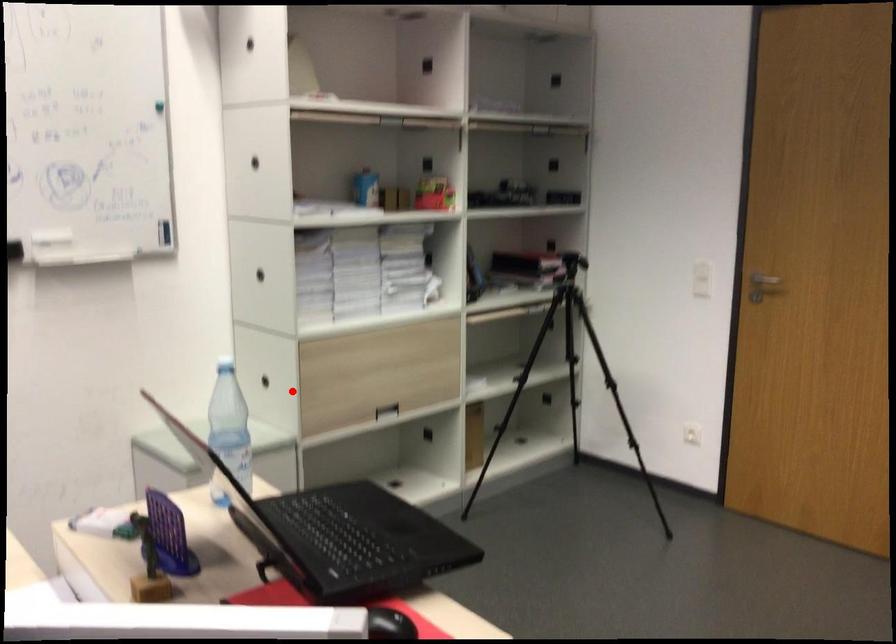
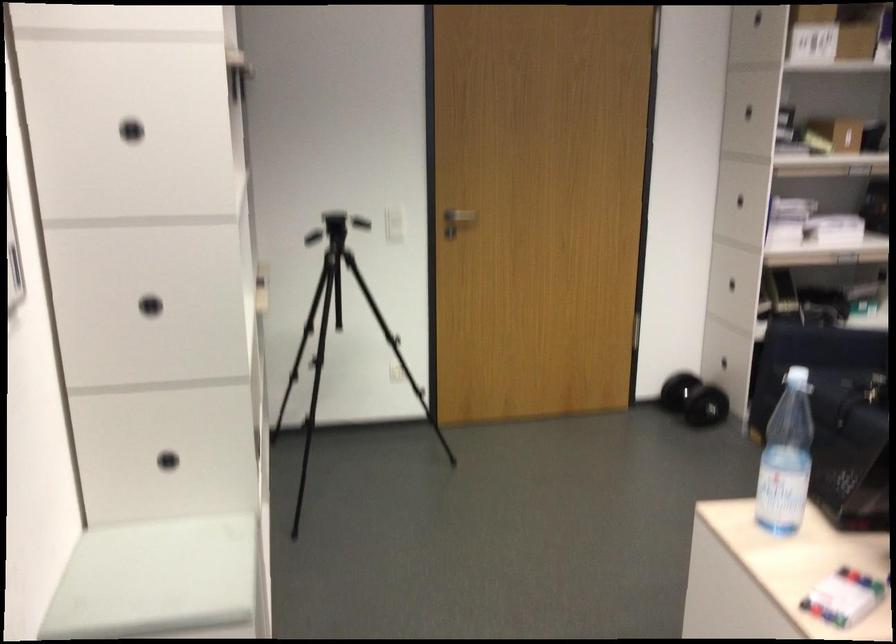
Question: I am providing you with two images of the same scene from different viewpoints. Given a red point in image1, look at the same physical point in image2. Is it:

Choices:
 (A) Closer to the viewpoint
 (B) Farther from the viewpoint

Answer: (A)